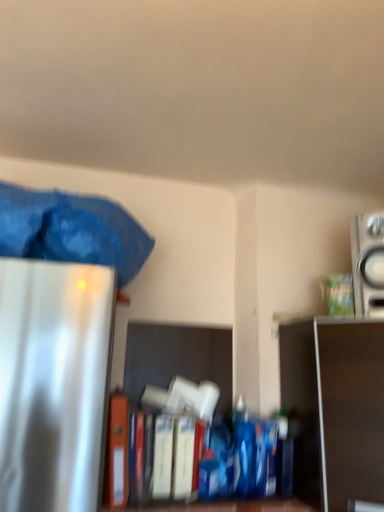
Question: In the image, is orange matte file folder at center positioned in front of or behind silver metallic speaker at upper right?

Choices:
 (A) behind
 (B) front

Answer: (B)

Question: Considering the positions of point (112, 456) and point (382, 241), is point (112, 456) closer or farther from the camera than point (382, 241)?

Choices:
 (A) closer
 (B) farther

Answer: (A)

Question: Which of these objects is positioned closest to the blue fabric bag at upper left?

Choices:
 (A) orange matte file folder at center
 (B) silver metallic speaker at upper right
 (C) metallic silver shelf at right

Answer: (A)

Question: Which object is the closest to the metallic silver shelf at right?

Choices:
 (A) orange matte file folder at center
 (B) blue fabric bag at upper left
 (C) silver metallic speaker at upper right

Answer: (C)